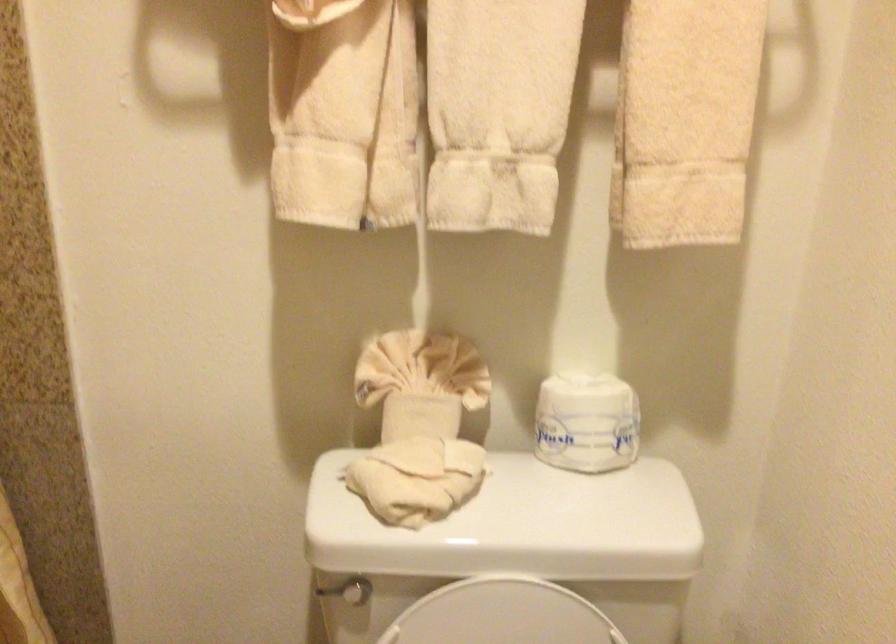
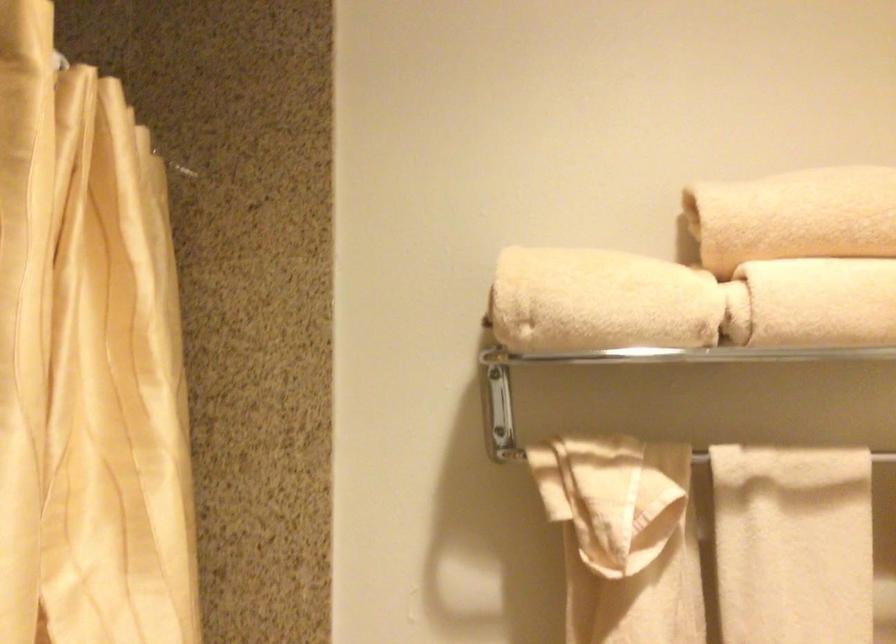
Which direction would the cameraman need to move to produce the second image?

The movement direction of the cameraman is left, backward.